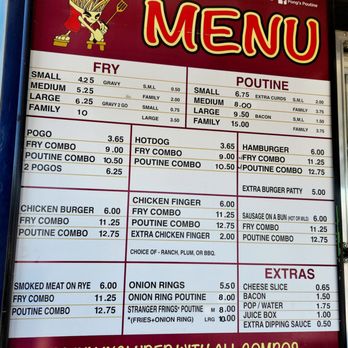
The width and height of the screenshot is (348, 348). Identify the location of frame. (338, 190), (13, 210).